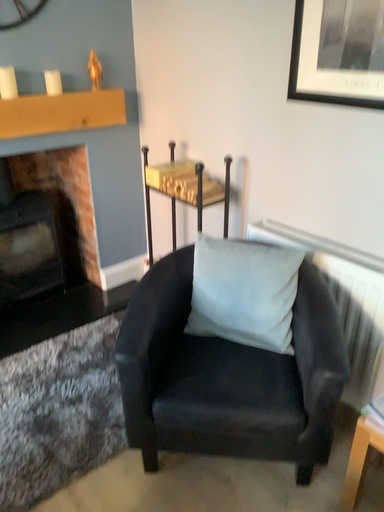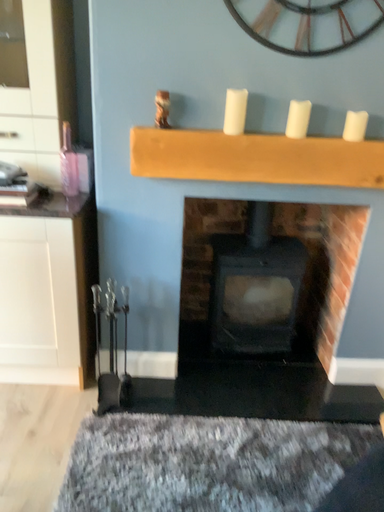
Question: Which way did the camera rotate in the video?

Choices:
 (A) rotated left
 (B) rotated right

Answer: (A)